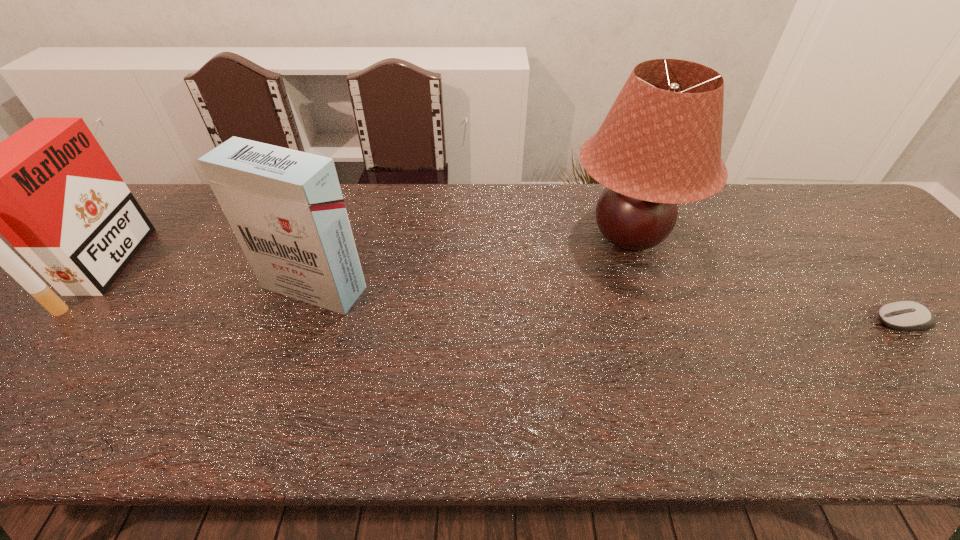
In the image, there is a desktop. Where is `free space at the near edge`? free space at the near edge is located at coordinates (931, 443).

In the image, there is a desktop. Where is `vacant space at the far left corner`? vacant space at the far left corner is located at coordinates (166, 190).

At what (x,y) coordinates should I click in order to perform the action: click on free space at the far right corner of the desktop. Please return your answer as a coordinate pair (x, y). The width and height of the screenshot is (960, 540). Looking at the image, I should click on (848, 214).

Identify the location of unoccupied position between the leftmost object and the computer equipment. The height and width of the screenshot is (540, 960). (504, 295).

At what (x,y) coordinates should I click in order to perform the action: click on free space between the tallest object and the computer equipment. Please return your answer as a coordinate pair (x, y). This screenshot has height=540, width=960. Looking at the image, I should click on (765, 279).

At what (x,y) coordinates should I click in order to perform the action: click on unoccupied position between the third object from right to left and the rightmost object. Please return your answer as a coordinate pair (x, y). This screenshot has width=960, height=540. Looking at the image, I should click on (609, 305).

Locate an element on the screen. The height and width of the screenshot is (540, 960). empty location between the shortest object and the right cigarette case is located at coordinates (609, 305).

This screenshot has height=540, width=960. In order to click on blank region between the rightmost object and the second object from left to right in this screenshot , I will do `click(609, 305)`.

Identify the location of unoccupied position between the second object from right to left and the second object from left to right. (471, 261).

Find the location of `vacant space that is in between the leftmost object and the right cigarette case`. vacant space that is in between the leftmost object and the right cigarette case is located at coordinates (209, 278).